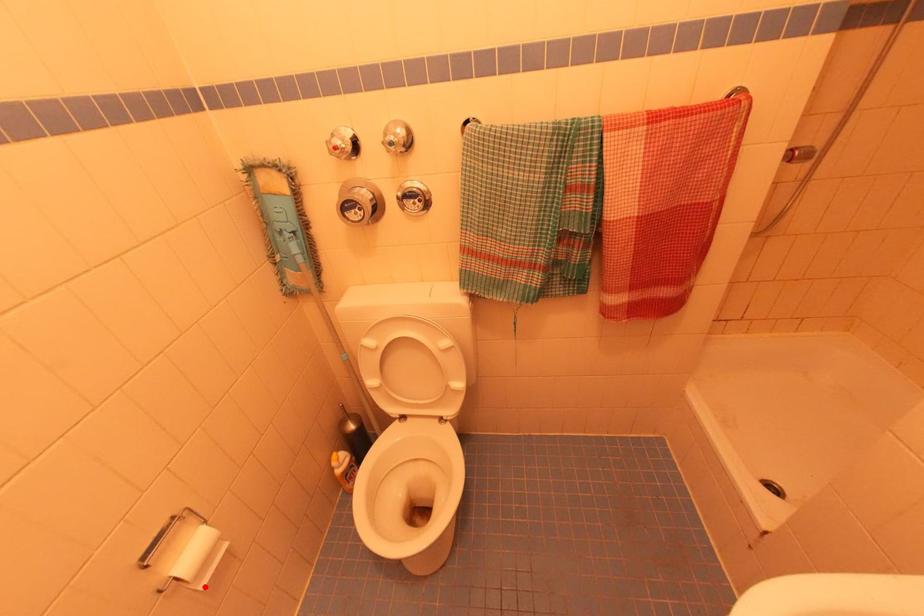
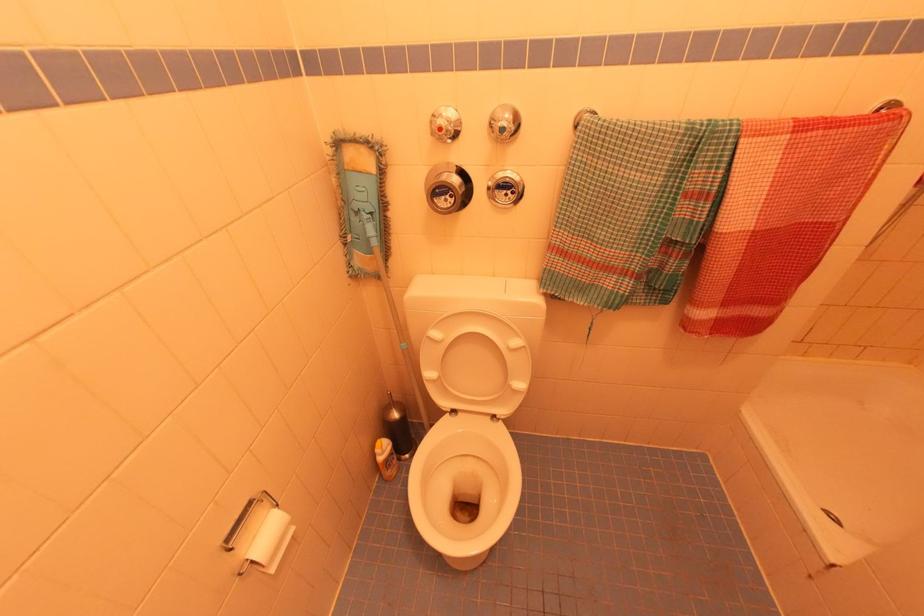
Find the pixel in the second image that matches the highlighted location in the first image.

(274, 570)